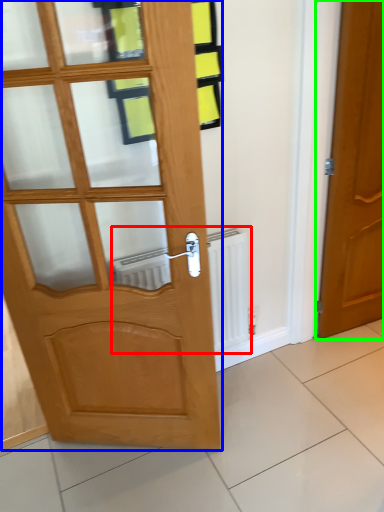
Question: Which object is the closest to the radiator (highlighted by a red box)? Choose among these: door (highlighted by a blue box) or door (highlighted by a green box).

Choices:
 (A) door
 (B) door

Answer: (A)